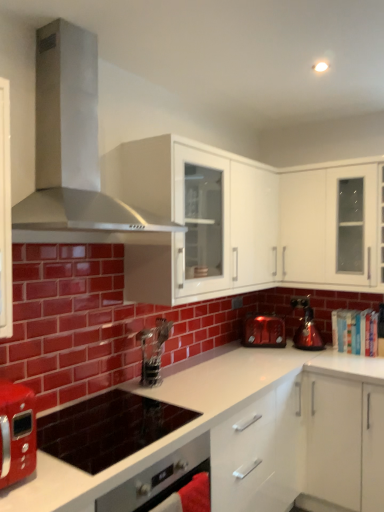
At what (x,y) coordinates should I click in order to perform the action: click on metallic silver coffee machine at center. Please return your answer as a coordinate pair (x, y). This screenshot has width=384, height=512. Looking at the image, I should click on (153, 350).

This screenshot has height=512, width=384. What are the coordinates of `matte red toaster at center, which is the first kitchen appliance from left to right` in the screenshot? It's located at (263, 331).

In order to click on white glossy cabinet at upper center, marked as the 2th cabinetry in a right-to-left arrangement in this screenshot , I will do `click(249, 222)`.

This screenshot has width=384, height=512. In order to click on white glossy cabinet at upper right, positioned as the first cabinetry in right-to-left order in this screenshot , I will do point(331,225).

Locate an element on the screen. metallic silver coffee machine at center is located at coordinates (153, 350).

Is white glossy cabinet at upper right, positioned as the first cabinetry in right-to-left order, positioned with its back to white glossy countertop at center?

white glossy cabinet at upper right, positioned as the first cabinetry in right-to-left order, does not have its back to white glossy countertop at center.

Which object is closer to the camera, white glossy cabinet at upper right, which appears as the second cabinetry when viewed from the left, or white glossy countertop at center?

white glossy countertop at center is in front.

The width and height of the screenshot is (384, 512). In order to click on countertop on the left of the white glossy cabinet at upper right, positioned as the first cabinetry in right-to-left order in this screenshot , I will do pos(250,434).

Is white glossy cabinet at upper right, which appears as the second cabinetry when viewed from the left, smaller than white glossy countertop at center?

Yes, white glossy cabinet at upper right, which appears as the second cabinetry when viewed from the left, is smaller than white glossy countertop at center.

Consider the image. Does white glossy countertop at center lie in front of white glossy cabinet at upper center, the 1th cabinetry viewed from the left?

Yes, it is in front of white glossy cabinet at upper center, the 1th cabinetry viewed from the left.

Is white glossy countertop at center outside of white glossy cabinet at upper center, the 1th cabinetry viewed from the left?

white glossy countertop at center lies outside white glossy cabinet at upper center, the 1th cabinetry viewed from the left,'s area.

From the image's perspective, is white glossy countertop at center on white glossy cabinet at upper center, marked as the 2th cabinetry in a right-to-left arrangement?

No, from the image's perspective, white glossy countertop at center is not on top of white glossy cabinet at upper center, marked as the 2th cabinetry in a right-to-left arrangement.

Which of these two, white glossy countertop at center or white glossy cabinet at upper center, the 1th cabinetry viewed from the left, stands shorter?

white glossy cabinet at upper center, the 1th cabinetry viewed from the left, is shorter.

Who is more distant, stainless steel range hood at upper left or matte red toaster at center, which is the first kitchen appliance from left to right?

Positioned behind is matte red toaster at center, which is the first kitchen appliance from left to right.

How different are the orientations of stainless steel range hood at upper left and matte red toaster at center, placed as the 2th kitchen appliance when sorted from right to left, in degrees?

The angle between the facing direction of stainless steel range hood at upper left and the facing direction of matte red toaster at center, placed as the 2th kitchen appliance when sorted from right to left, is 54.7 degrees.

From a real-world perspective, is stainless steel range hood at upper left positioned under matte red toaster at center, which is the first kitchen appliance from left to right, based on gravity?

No, from a real-world perspective, stainless steel range hood at upper left is not beneath matte red toaster at center, which is the first kitchen appliance from left to right.

Is stainless steel range hood at upper left oriented away from matte red toaster at center, which is the first kitchen appliance from left to right?

stainless steel range hood at upper left is not turned away from matte red toaster at center, which is the first kitchen appliance from left to right.

How many degrees apart are the facing directions of white glossy cabinet at upper right, positioned as the first cabinetry in right-to-left order, and white glossy cabinet at upper center, the 1th cabinetry viewed from the left?

90 degrees.

Is point (364, 282) closer to viewer compared to point (161, 183)?

No, it is behind (161, 183).

Consider the image. Does white glossy cabinet at upper right, positioned as the first cabinetry in right-to-left order, have a greater height compared to white glossy cabinet at upper center, the 1th cabinetry viewed from the left?

No, white glossy cabinet at upper right, positioned as the first cabinetry in right-to-left order, is not taller than white glossy cabinet at upper center, the 1th cabinetry viewed from the left.

Who is more distant, white glossy cabinet at upper right, positioned as the first cabinetry in right-to-left order, or white glossy cabinet at upper center, the 1th cabinetry viewed from the left?

white glossy cabinet at upper right, positioned as the first cabinetry in right-to-left order.

Considering the positions of objects matte red toaster at center, which is the first kitchen appliance from left to right, and stainless steel range hood at upper left in the image provided, who is more to the right, matte red toaster at center, which is the first kitchen appliance from left to right, or stainless steel range hood at upper left?

matte red toaster at center, which is the first kitchen appliance from left to right.

Are matte red toaster at center, placed as the 2th kitchen appliance when sorted from right to left, and stainless steel range hood at upper left located far from each other?

Yes, matte red toaster at center, placed as the 2th kitchen appliance when sorted from right to left, and stainless steel range hood at upper left are quite far apart.

Could stainless steel range hood at upper left be considered to be inside matte red toaster at center, placed as the 2th kitchen appliance when sorted from right to left?

No, matte red toaster at center, placed as the 2th kitchen appliance when sorted from right to left, does not contain stainless steel range hood at upper left.

Which point is more distant from viewer, (276, 327) or (64, 225)?

The point (276, 327) is farther from the camera.

Is matte red toaster at center, which is the first kitchen appliance from left to right, looking in the opposite direction of metallic silver coffee machine at center?

No, matte red toaster at center, which is the first kitchen appliance from left to right, is not facing the opposite direction of metallic silver coffee machine at center.

Considering the positions of points (265, 319) and (169, 326), is point (265, 319) closer to camera compared to point (169, 326)?

No, (265, 319) is further to viewer.

From a real-world perspective, is matte red toaster at center, placed as the 2th kitchen appliance when sorted from right to left, over metallic silver coffee machine at center?

No.

Are matte red toaster at center, which is the first kitchen appliance from left to right, and metallic silver coffee machine at center located far from each other?

matte red toaster at center, which is the first kitchen appliance from left to right, is actually quite close to metallic silver coffee machine at center.

Is shiny metallic kettle at right, positioned as the 1th kitchen appliance in right-to-left order, spatially inside white glossy cabinet at upper right, positioned as the first cabinetry in right-to-left order, or outside of it?

shiny metallic kettle at right, positioned as the 1th kitchen appliance in right-to-left order, is not enclosed by white glossy cabinet at upper right, positioned as the first cabinetry in right-to-left order.

From the picture: Which point is more distant from viewer, (311,341) or (307,222)?

The point (311,341) is more distant.

From the image's perspective, is shiny metallic kettle at right, the second kitchen appliance from the left, above white glossy cabinet at upper right, which appears as the second cabinetry when viewed from the left?

No, from the image's perspective, shiny metallic kettle at right, the second kitchen appliance from the left, is not over white glossy cabinet at upper right, which appears as the second cabinetry when viewed from the left.

From a real-world perspective, who is located higher, shiny metallic kettle at right, positioned as the 1th kitchen appliance in right-to-left order, or white glossy cabinet at upper right, positioned as the first cabinetry in right-to-left order?

white glossy cabinet at upper right, positioned as the first cabinetry in right-to-left order.

Where is `countertop in front of the white glossy cabinet at upper right, which appears as the second cabinetry when viewed from the left`? This screenshot has width=384, height=512. countertop in front of the white glossy cabinet at upper right, which appears as the second cabinetry when viewed from the left is located at coordinates (250, 434).

Find the location of a particular element. This screenshot has width=384, height=512. countertop that is on the left side of white glossy cabinet at upper center, marked as the 2th cabinetry in a right-to-left arrangement is located at coordinates (250, 434).

Looking at the image, which one is located closer to white glossy cabinet at upper right, which appears as the second cabinetry when viewed from the left, matte red toaster at center, placed as the 2th kitchen appliance when sorted from right to left, or metallic silver coffee machine at center?

matte red toaster at center, placed as the 2th kitchen appliance when sorted from right to left, is positioned closer to the anchor white glossy cabinet at upper right, which appears as the second cabinetry when viewed from the left.

Considering their positions, is metallic silver coffee machine at center positioned closer to white glossy cabinet at upper right, positioned as the first cabinetry in right-to-left order, than matte red toaster at center, placed as the 2th kitchen appliance when sorted from right to left?

The object closer to white glossy cabinet at upper right, positioned as the first cabinetry in right-to-left order, is matte red toaster at center, placed as the 2th kitchen appliance when sorted from right to left.

Considering their positions, is metallic silver coffee machine at center positioned further to shiny metallic kettle at right, the second kitchen appliance from the left, than white glossy cabinet at upper right, which appears as the second cabinetry when viewed from the left?

Based on the image, metallic silver coffee machine at center appears to be further to shiny metallic kettle at right, the second kitchen appliance from the left.

Based on the photo, based on their spatial positions, is white glossy countertop at center or matte red toaster at center, placed as the 2th kitchen appliance when sorted from right to left, closer to white glossy cabinet at upper center, the 1th cabinetry viewed from the left?

matte red toaster at center, placed as the 2th kitchen appliance when sorted from right to left, lies closer to white glossy cabinet at upper center, the 1th cabinetry viewed from the left, than the other object.

Considering their positions, is matte black cooktop at center positioned further to white glossy cabinet at upper center, the 1th cabinetry viewed from the left, than stainless steel range hood at upper left?

The object further to white glossy cabinet at upper center, the 1th cabinetry viewed from the left, is matte black cooktop at center.

Which object lies nearer to the anchor point white glossy countertop at center, white glossy cabinet at upper right, positioned as the first cabinetry in right-to-left order, or matte red toaster at center, which is the first kitchen appliance from left to right?

matte red toaster at center, which is the first kitchen appliance from left to right.

Which object lies further to the anchor point white glossy countertop at center, white glossy cabinet at upper right, positioned as the first cabinetry in right-to-left order, or stainless steel range hood at upper left?

stainless steel range hood at upper left is further to white glossy countertop at center.

Looking at the image, which one is located closer to matte black cooktop at center, white glossy cabinet at upper center, marked as the 2th cabinetry in a right-to-left arrangement, or white glossy cabinet at upper right, which appears as the second cabinetry when viewed from the left?

Based on the image, white glossy cabinet at upper center, marked as the 2th cabinetry in a right-to-left arrangement, appears to be nearer to matte black cooktop at center.

This screenshot has height=512, width=384. In order to click on appliance between white glossy countertop at center and white glossy cabinet at upper right, positioned as the first cabinetry in right-to-left order, from front to back in this screenshot , I will do `click(107, 428)`.

Where is `appliance between white glossy countertop at center and metallic silver coffee machine at center in the front-back direction`? This screenshot has width=384, height=512. appliance between white glossy countertop at center and metallic silver coffee machine at center in the front-back direction is located at coordinates (107, 428).

At what (x,y) coordinates should I click in order to perform the action: click on kitchen appliance between stainless steel range hood at upper left and matte red toaster at center, placed as the 2th kitchen appliance when sorted from right to left, in the front-back direction. Please return your answer as a coordinate pair (x, y). The height and width of the screenshot is (512, 384). Looking at the image, I should click on (306, 327).

I want to click on home appliance between white glossy countertop at center and matte red toaster at center, placed as the 2th kitchen appliance when sorted from right to left, from front to back, so click(74, 153).